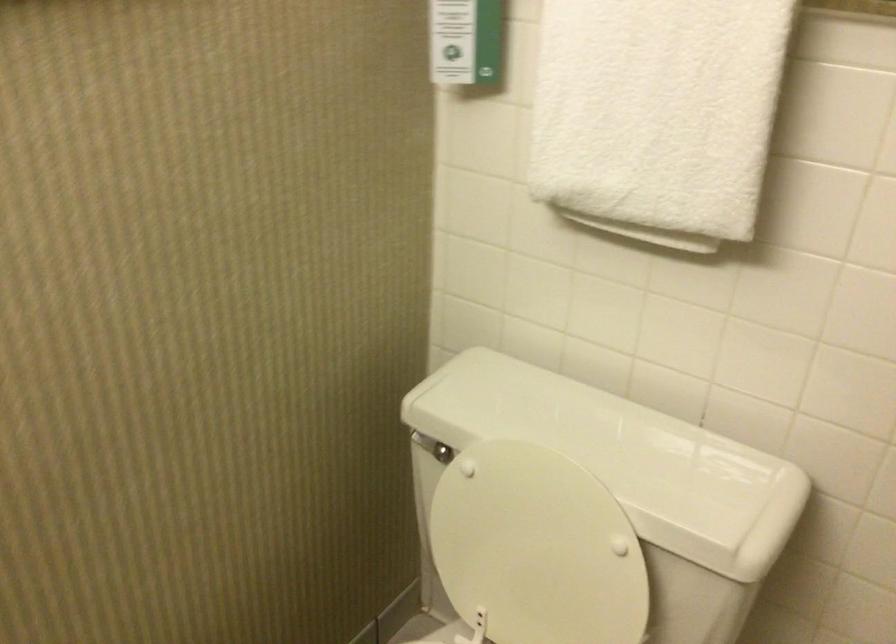
Find where to push the toilet flush handle. Please return your answer as a coordinate pair (x, y).

(425, 444)